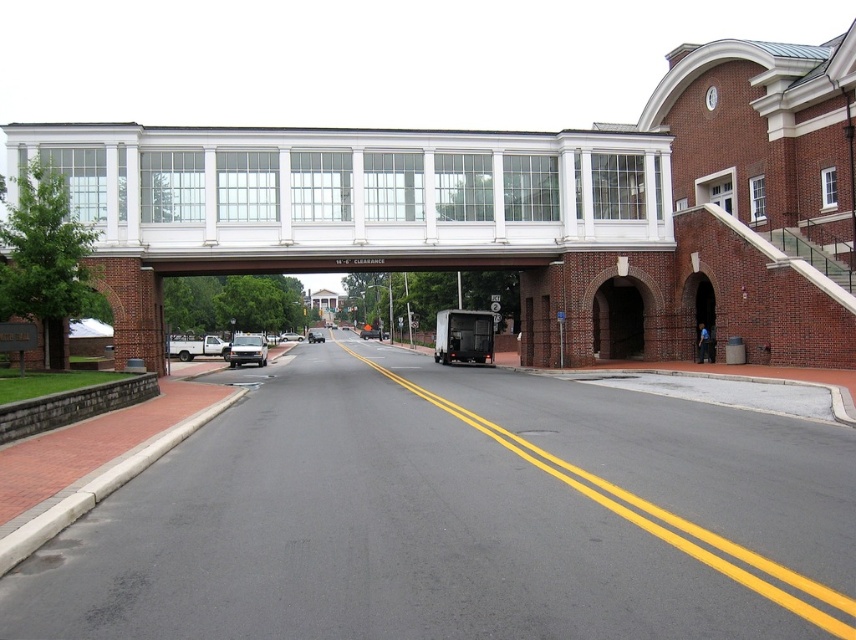
You are standing on the street looking up at the pedestrian overpass. There are two points marked on the overpass structure. Which point, point (413, 266) or point (296, 340), is closer to you?

Point (413, 266) is closer to the viewer than point (296, 340).

You are a delivery driver trying to navigate through the street under the red brick overpass. You see a silver metallic van at center and a silver metallic sedan at center. Which vehicle is blocking your path closer to the overpass?

The silver metallic van at center is above the silver metallic sedan at center, meaning it is positioned closer to the overpass, so the van is blocking your path closer to the overpass.